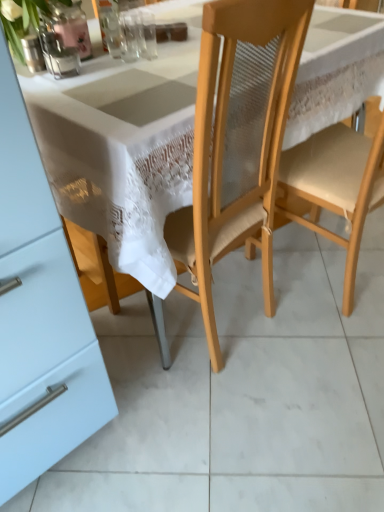
I want to click on free space in front of matte glass vase at upper left, which is counted as the first tableware, starting from the left, so click(x=51, y=86).